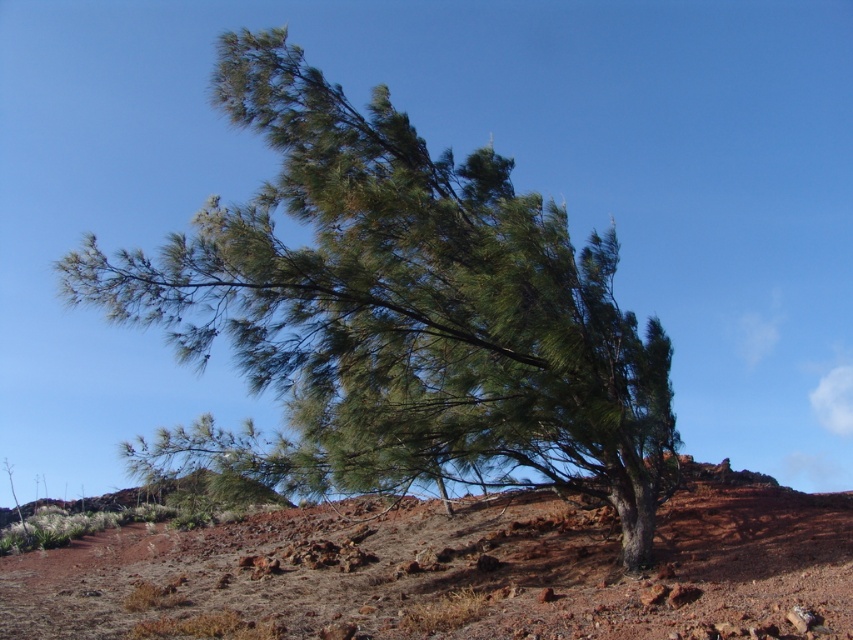
Who is taller, green needle-like leaves at center or dried grass at center?

green needle-like leaves at center

Is green needle-like leaves at center thinner than dried grass at center?

Yes.

Who is more forward, (656, 365) or (506, 637)?

Point (506, 637) is more forward.

Find the location of a particular element. Image resolution: width=853 pixels, height=640 pixels. green needle-like leaves at center is located at coordinates pos(405,307).